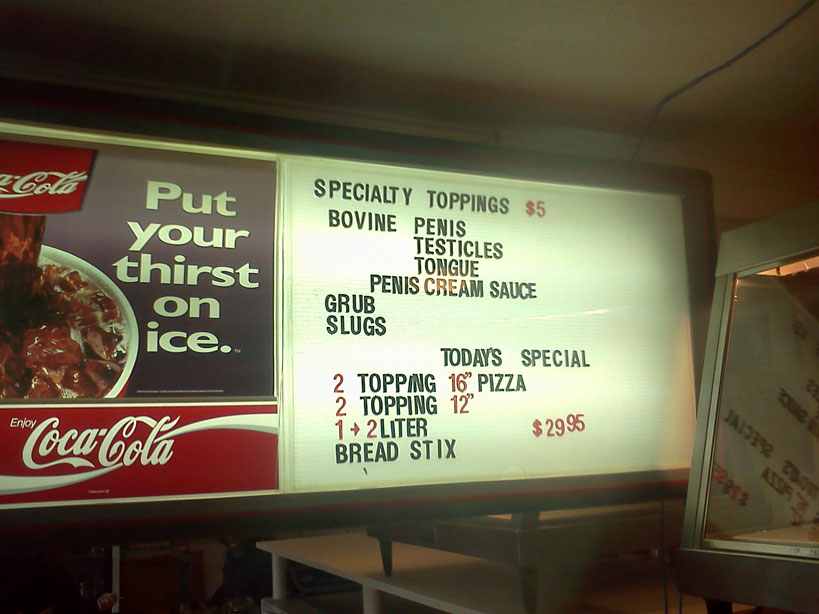
Identify the location of power cord. This screenshot has width=819, height=614. (708, 74).